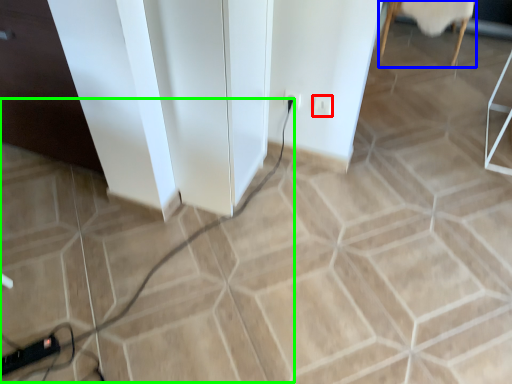
Question: Based on their relative distances, which object is farther from socket (highlighted by a red box)? Choose from furniture (highlighted by a blue box) and cable (highlighted by a green box).

Choices:
 (A) furniture
 (B) cable

Answer: (A)